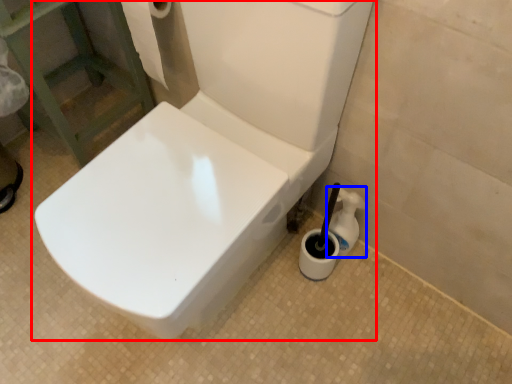
Question: Which point is closer to the camera, toilet (highlighted by a red box) or cleaning product (highlighted by a blue box)?

Choices:
 (A) toilet
 (B) cleaning product

Answer: (A)